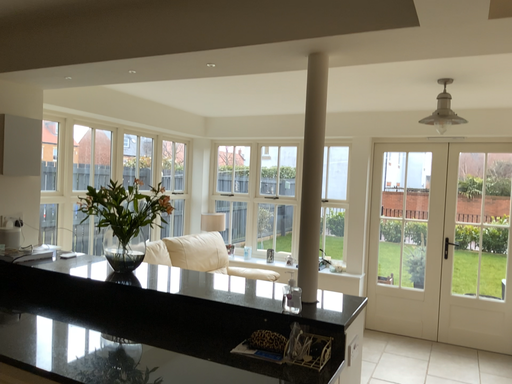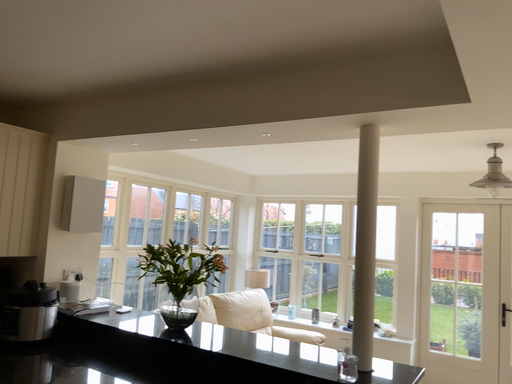
Question: Which way did the camera rotate in the video?

Choices:
 (A) rotated downward
 (B) rotated upward

Answer: (B)